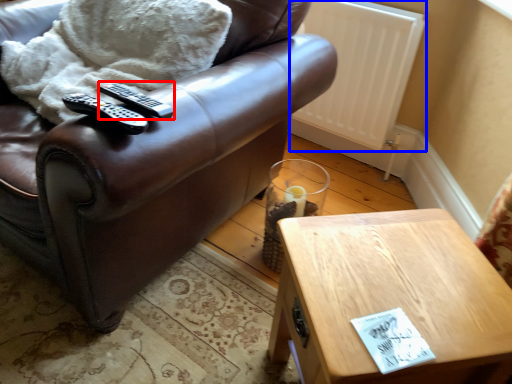
Question: Among these objects, which one is farthest to the camera, remote (highlighted by a red box) or radiator (highlighted by a blue box)?

Choices:
 (A) remote
 (B) radiator

Answer: (B)